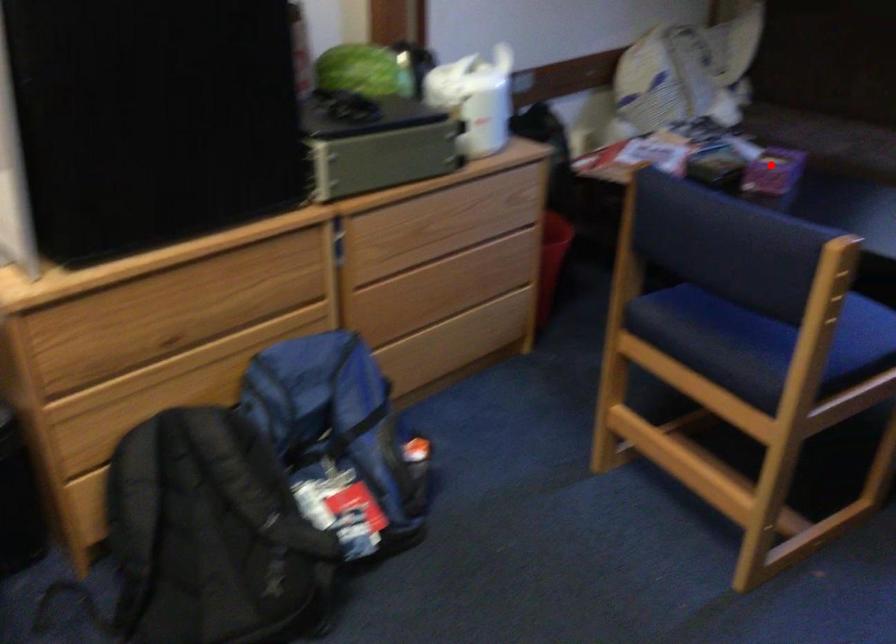
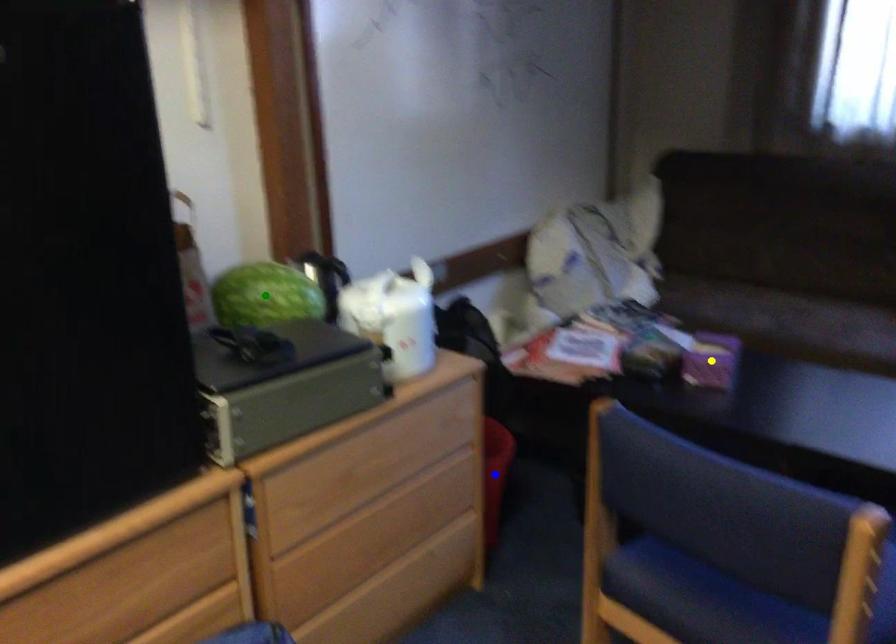
Question: I am providing you with two images of the same scene from different viewpoints. A red point is marked on the first image. You are given multiple points on the second image. In image 2, which mark is for the same physical point as the one in image 1?

Choices:
 (A) blue point
 (B) yellow point
 (C) green point

Answer: (B)